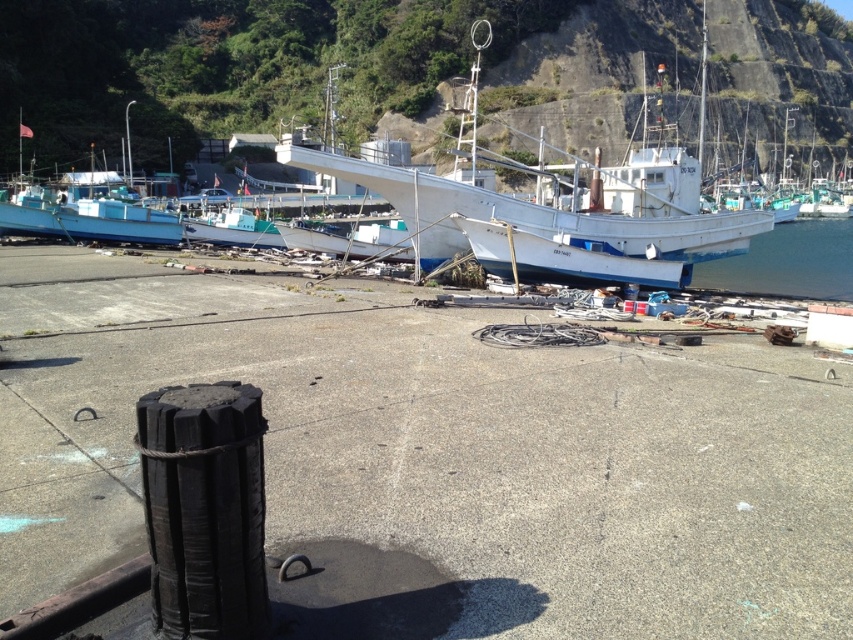
You are a marine biologist who needs to place a buoy at point 0.323, 0.655. The white matte boat at center is located at that point. Can you place the buoy there without disturbing the boat?

The white matte boat at center is located at point (558, 205), so placing the buoy there would directly interfere with the boat. Choose a different location.